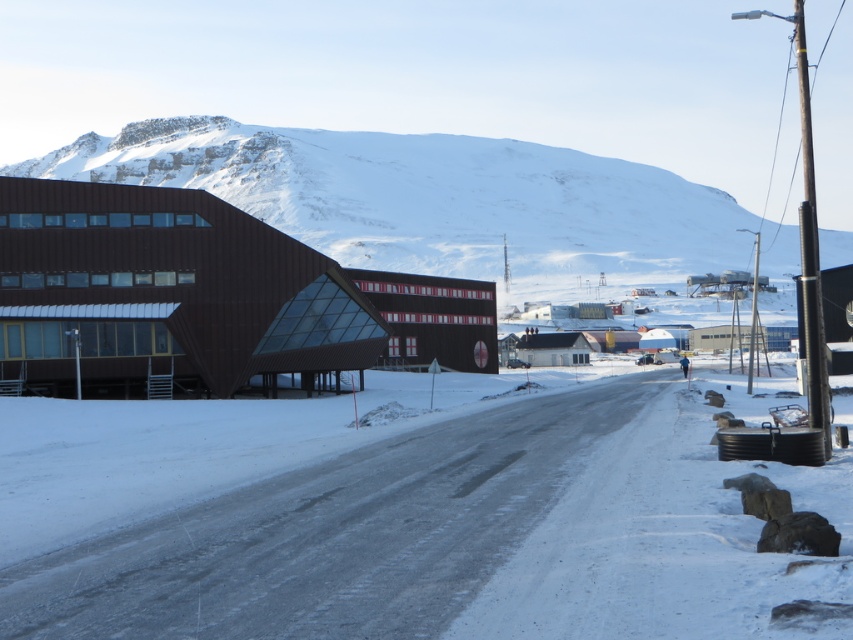
Question: Which point appears farthest from the camera in this image?

Choices:
 (A) (601, 176)
 (B) (334, 477)

Answer: (A)

Question: Can you confirm if white powdery snow at center is thinner than snowy mountain at upper center?

Choices:
 (A) yes
 (B) no

Answer: (A)

Question: Among these points, which one is farthest from the camera?

Choices:
 (A) (741, 240)
 (B) (155, 620)

Answer: (A)

Question: Is the position of white powdery snow at center less distant than that of snowy mountain at upper center?

Choices:
 (A) no
 (B) yes

Answer: (B)

Question: Considering the relative positions of white powdery snow at center and snowy mountain at upper center in the image provided, where is white powdery snow at center located with respect to snowy mountain at upper center?

Choices:
 (A) right
 (B) left

Answer: (A)